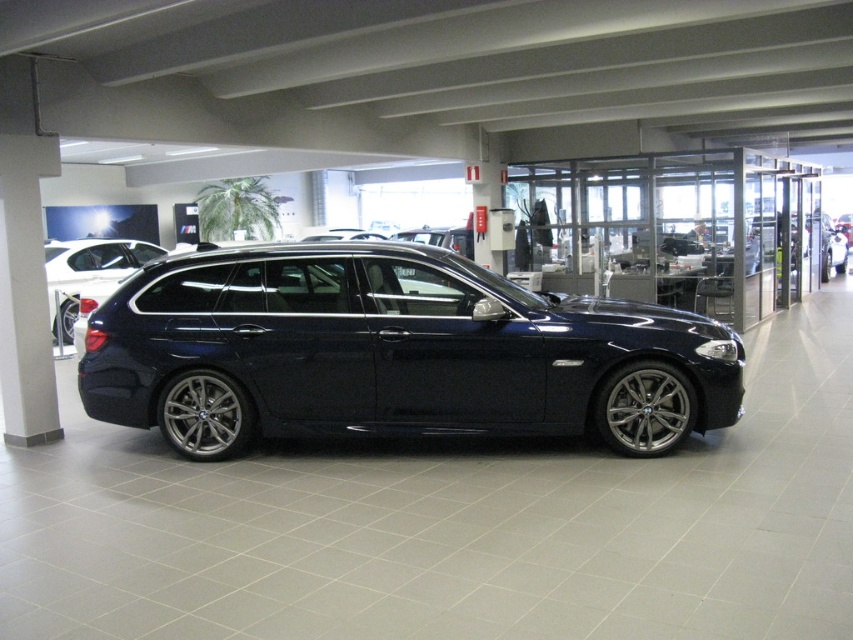
Between point (44, 401) and point (86, 256), which one is positioned in front?

Point (44, 401)

Is point (42, 234) positioned in front of point (120, 240)?

Yes, point (42, 234) is in front of point (120, 240).

Who is more distant from viewer, (9, 372) or (64, 342)?

Positioned behind is point (64, 342).

Identify the location of white glossy pillar at left. (25, 292).

Is point (47, 170) closer to viewer compared to point (819, 250)?

Yes, it is.

Who is more distant from viewer, (7, 132) or (802, 225)?

The point (802, 225) is more distant.

Locate an element on the screen. Image resolution: width=853 pixels, height=640 pixels. white glossy pillar at left is located at coordinates (25, 292).

Does satin black car at center appear on the right side of glossy dark blue sedan at center?

In fact, satin black car at center is to the left of glossy dark blue sedan at center.

The height and width of the screenshot is (640, 853). Find the location of `satin black car at center`. satin black car at center is located at coordinates (86, 273).

Does point (73, 280) come in front of point (824, 253)?

Yes.

This screenshot has width=853, height=640. I want to click on satin black car at center, so click(86, 273).